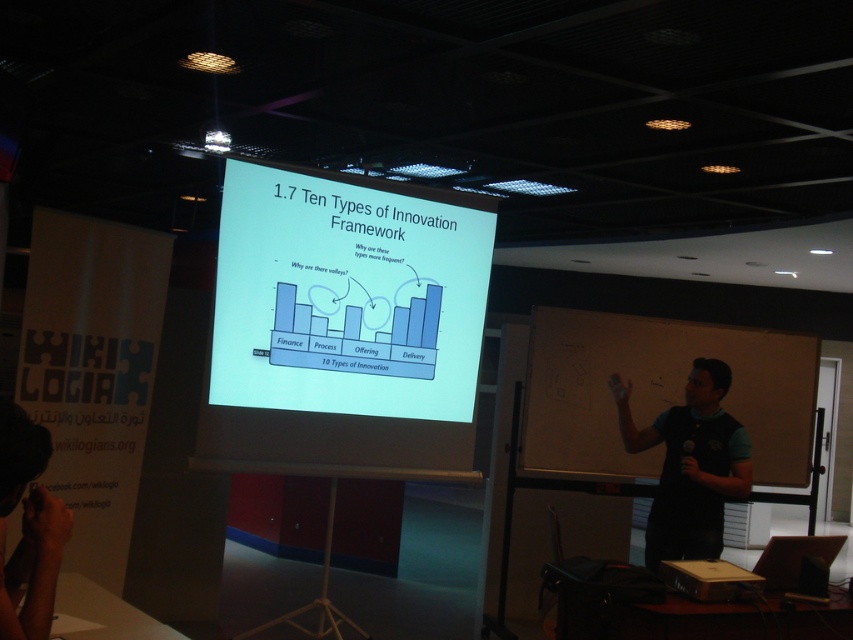
Question: Which object is the farthest from the black fabric camera at lower left?

Choices:
 (A) blackboard at right
 (B) white glossy projection screen at center
 (C) black fabric shirt at right

Answer: (A)

Question: Is white glossy projection screen at center wider than blackboard at right?

Choices:
 (A) no
 (B) yes

Answer: (A)

Question: Is blackboard at right positioned behind black fabric shirt at right?

Choices:
 (A) no
 (B) yes

Answer: (B)

Question: Does white glossy projection screen at center come behind black fabric shirt at right?

Choices:
 (A) no
 (B) yes

Answer: (A)

Question: Which is farther from the blackboard at right?

Choices:
 (A) white glossy projection screen at center
 (B) black fabric camera at lower left
 (C) black fabric shirt at right

Answer: (B)

Question: Which object is positioned farthest from the blackboard at right?

Choices:
 (A) white glossy projection screen at center
 (B) black fabric camera at lower left

Answer: (B)